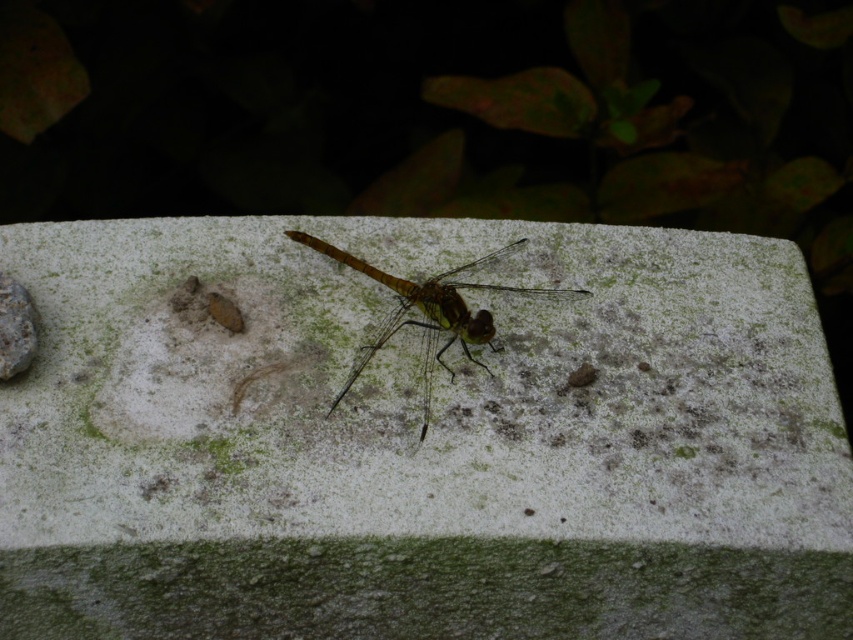
Question: Among these objects, which one is farthest from the camera?

Choices:
 (A) translucent yellow-green dragonfly at center
 (B) white rough concrete at center

Answer: (A)

Question: In this image, where is white rough concrete at center located relative to translucent yellow-green dragonfly at center?

Choices:
 (A) left
 (B) right

Answer: (A)

Question: Among these objects, which one is nearest to the camera?

Choices:
 (A) white rough concrete at center
 (B) translucent yellow-green dragonfly at center

Answer: (A)

Question: Can you confirm if white rough concrete at center is positioned above translucent yellow-green dragonfly at center?

Choices:
 (A) yes
 (B) no

Answer: (B)

Question: Does white rough concrete at center have a larger size compared to translucent yellow-green dragonfly at center?

Choices:
 (A) no
 (B) yes

Answer: (B)